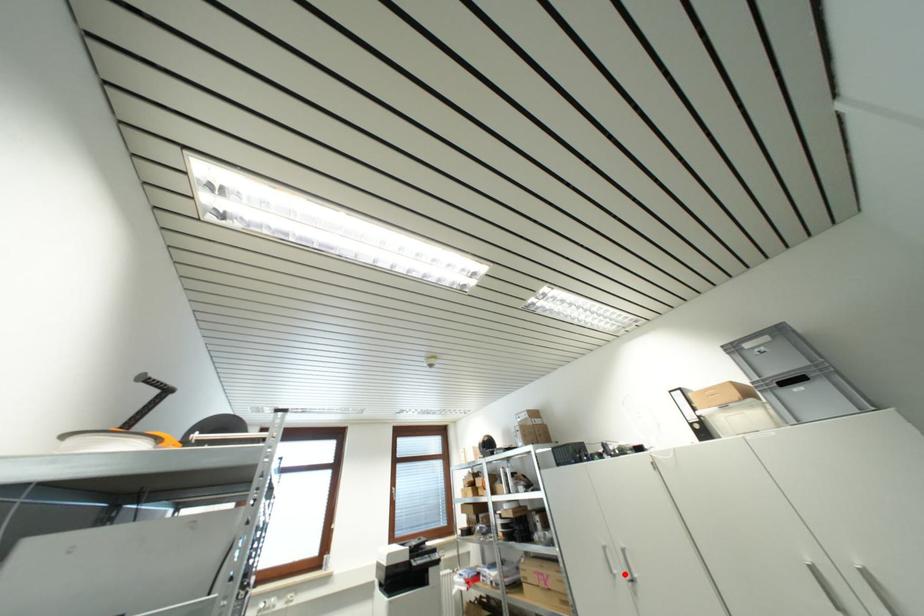
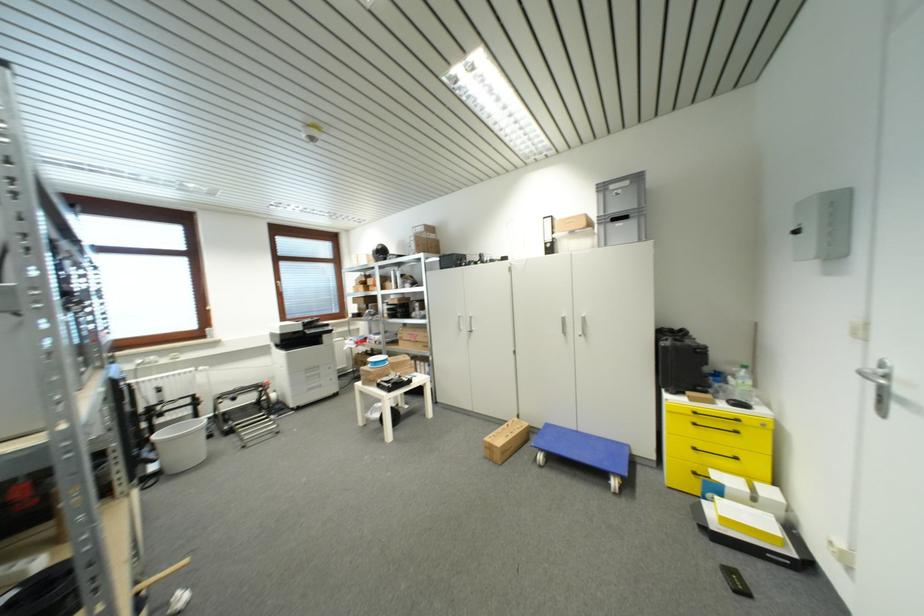
The point at the highlighted location is marked in the first image. Where is the corresponding point in the second image?

(468, 330)